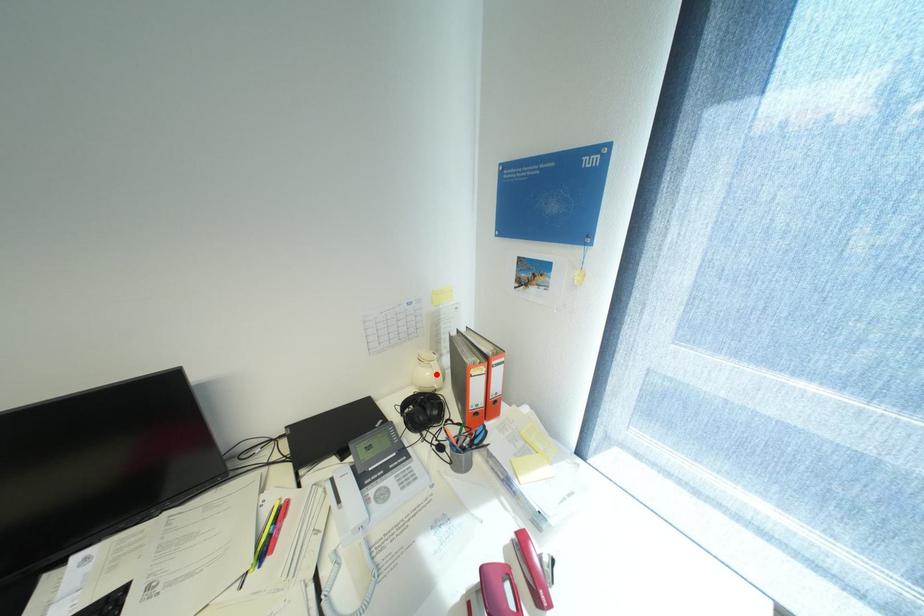
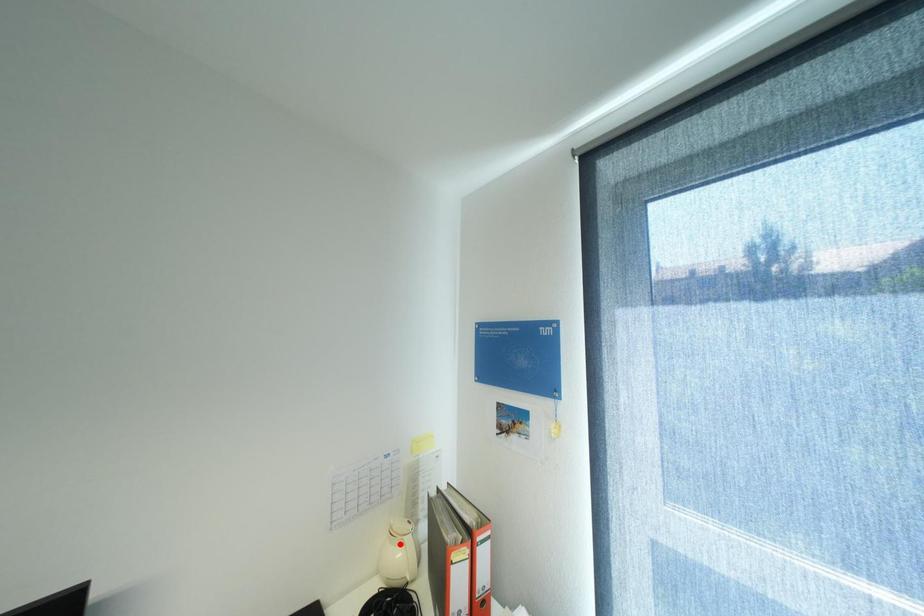
I am providing you with two images of the same scene from different viewpoints. A red point is marked on the first image and another point is marked on the second image. Do the highlighted points in image1 and image2 indicate the same real-world spot?

No